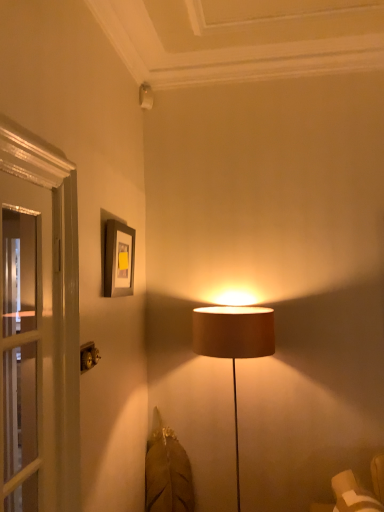
Question: Is metallic gold at lower left behind matte gray picture frame at upper left?

Choices:
 (A) yes
 (B) no

Answer: (B)

Question: From a real-world perspective, is metallic gold at lower left over matte gray picture frame at upper left?

Choices:
 (A) no
 (B) yes

Answer: (A)

Question: Is metallic gold at lower left shorter than matte gray picture frame at upper left?

Choices:
 (A) yes
 (B) no

Answer: (A)

Question: Considering the relative sizes of metallic gold at lower left and matte gray picture frame at upper left in the image provided, is metallic gold at lower left smaller than matte gray picture frame at upper left?

Choices:
 (A) no
 (B) yes

Answer: (B)

Question: Considering the relative sizes of metallic gold at lower left and matte gray picture frame at upper left in the image provided, is metallic gold at lower left wider than matte gray picture frame at upper left?

Choices:
 (A) yes
 (B) no

Answer: (B)

Question: Is matte gray picture frame at upper left a part of metallic gold at lower left?

Choices:
 (A) yes
 (B) no

Answer: (B)

Question: Is matte gray picture frame at upper left behind metallic gold at lower left?

Choices:
 (A) yes
 (B) no

Answer: (A)

Question: Is the position of matte gray picture frame at upper left less distant than that of metallic gold at lower left?

Choices:
 (A) no
 (B) yes

Answer: (A)

Question: Can you confirm if matte gray picture frame at upper left is smaller than metallic gold at lower left?

Choices:
 (A) yes
 (B) no

Answer: (B)

Question: From the image's perspective, is matte gray picture frame at upper left above metallic gold at lower left?

Choices:
 (A) no
 (B) yes

Answer: (B)

Question: Can you confirm if matte gray picture frame at upper left is wider than metallic gold at lower left?

Choices:
 (A) no
 (B) yes

Answer: (B)

Question: Considering the relative sizes of matte gray picture frame at upper left and metallic gold at lower left in the image provided, is matte gray picture frame at upper left taller than metallic gold at lower left?

Choices:
 (A) yes
 (B) no

Answer: (A)

Question: Looking at the image, does metallic gold at lower left seem bigger or smaller compared to matte gray picture frame at upper left?

Choices:
 (A) big
 (B) small

Answer: (B)